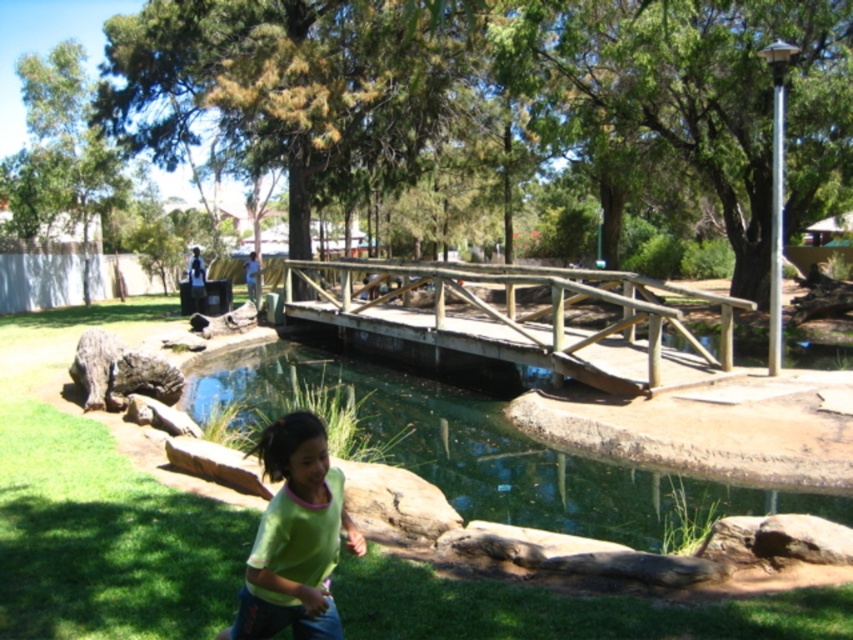
You are standing at the wooden bridge and want to cross to the other side. Is the clear water at bridge center directly under your feet if you step at the center of the bridge?

The clear water at bridge center is located at point (473,451), which is not exactly at the center of the bridge. Therefore, stepping at the center of the bridge would not place you directly over the clear water at bridge center.

You are a photographer setting up a tripod in the park. You want to capture both the wooden bridge at center and the green matte shirt at lower center in your shot. Which object will appear wider in the photo?

The wooden bridge at center will appear wider in the photo because its width surpasses that of the green matte shirt at lower center according to the description.

You are a photographer positioned at the park entrance. You want to capture a photo of the green matte shirt at lower center without the wooden bridge at center obstructing it. What should you do?

Move your position so that the green matte shirt at lower center is no longer behind the wooden bridge at center. Since the green matte shirt at lower center is currently behind the wooden bridge at center, adjusting your angle or moving closer to the shirt will allow you to frame the shot without the bridge blocking it.